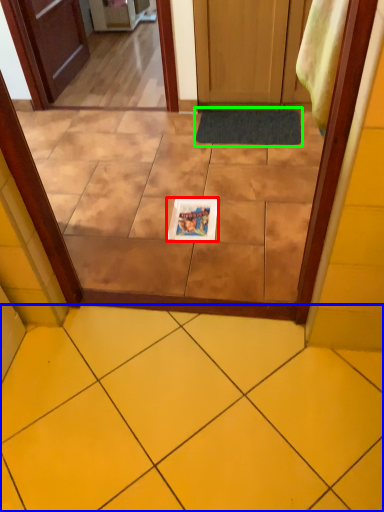
Question: Based on their relative distances, which object is farther from magazine (highlighted by a red box)? Choose from ceramic tile (highlighted by a blue box) and doormat (highlighted by a green box).

Choices:
 (A) ceramic tile
 (B) doormat

Answer: (A)